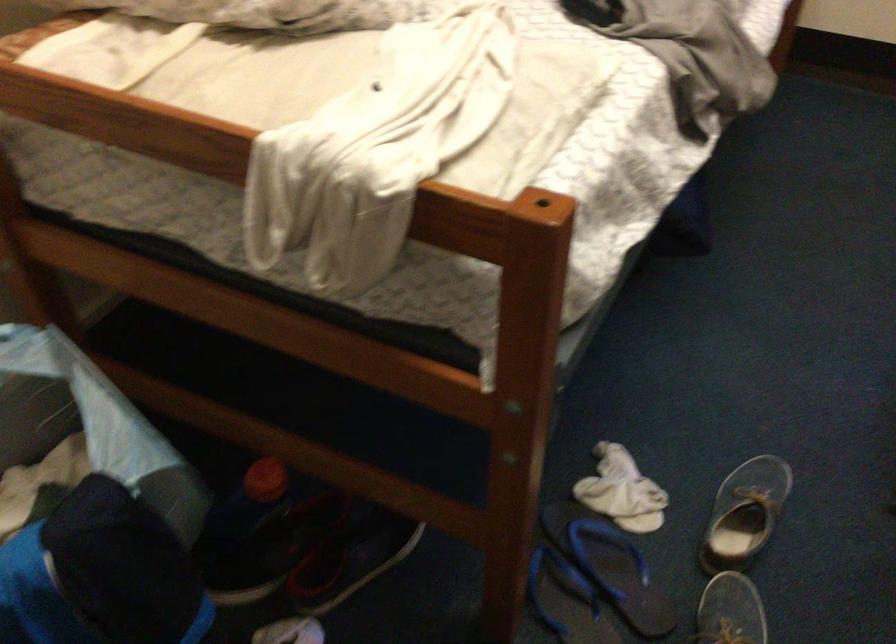
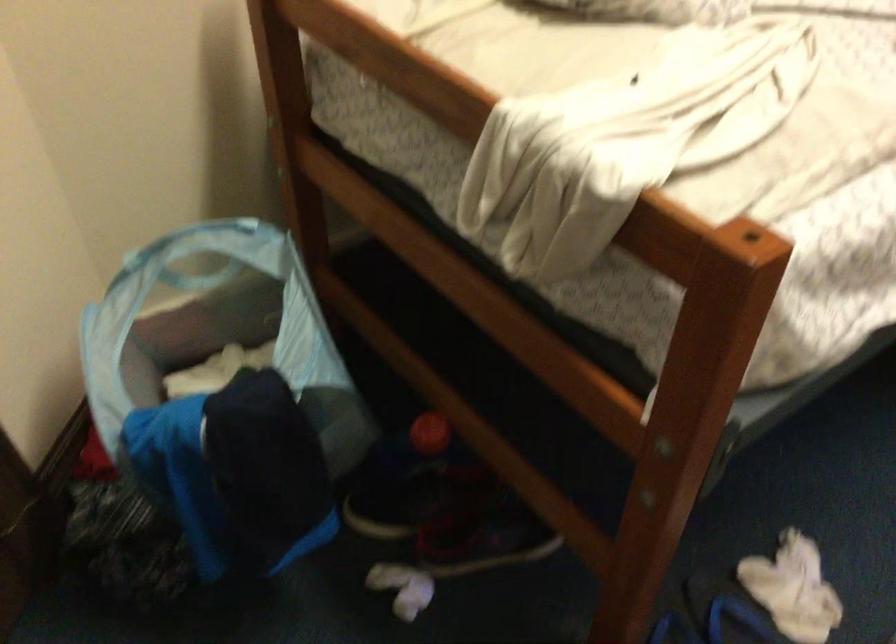
Which direction would the cameraman need to move to produce the second image?

The movement direction of the cameraman is right, forward.